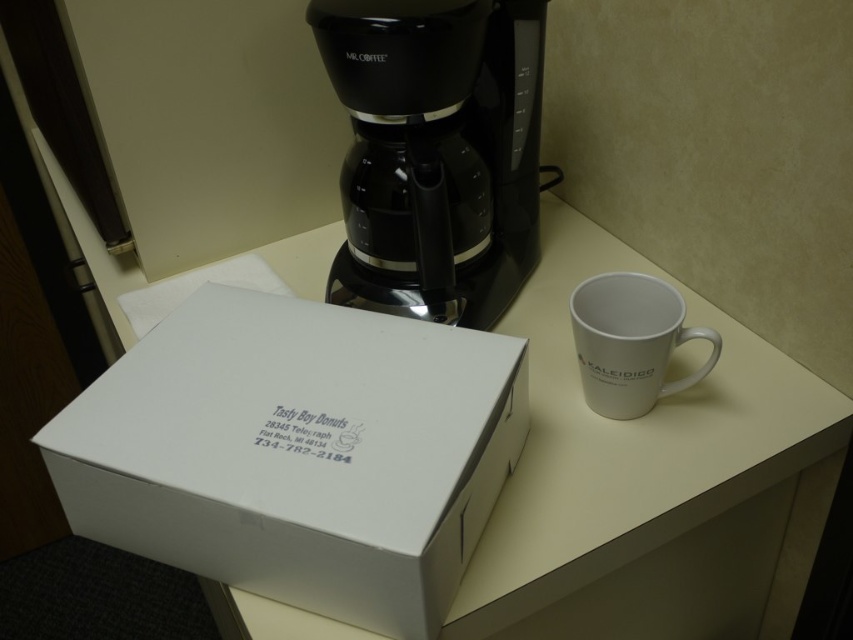
From the picture: You are organizing the workspace and want to place the white cardboard box at center and the white matte table at center in a way that maximizes the space. Which object should you place closer to the edge of the desk to ensure stability?

The white cardboard box at center is smaller than the white matte table at center, so placing the white cardboard box at center closer to the edge would allow the larger table to occupy more central space while maintaining stability.

You are organizing a small meeting and need to place a 12cm wide document on the white matte table at center and the white ceramic mug at right. Can both items fit side by side on the table?

The white matte table at center has a larger size compared to the white ceramic mug at right, so yes, both items can fit side by side on the table.

You are a delivery person who needs to place a new coffee maker on the desk. The new coffee maker is 16 inches long. Can the white cardboard box at center be moved out of the way to make space for the new coffee maker?

The white cardboard box at center is 16.79 inches away from the camera. Since the new coffee maker is only 16 inches long, the box can be moved closer to the camera by approximately 0.79 inches to accommodate the new coffee maker without overlapping.